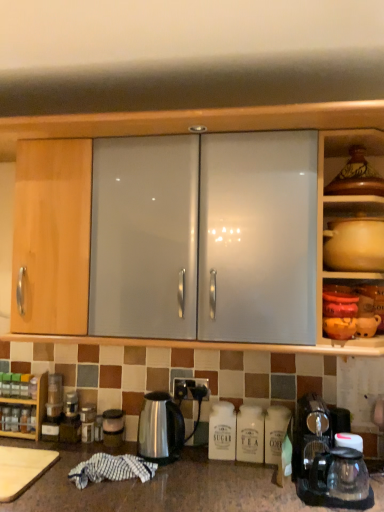
Where is `vacant point above brown matte vase at upper right (from a real-world perspective)`? The height and width of the screenshot is (512, 384). vacant point above brown matte vase at upper right (from a real-world perspective) is located at coordinates (360, 147).